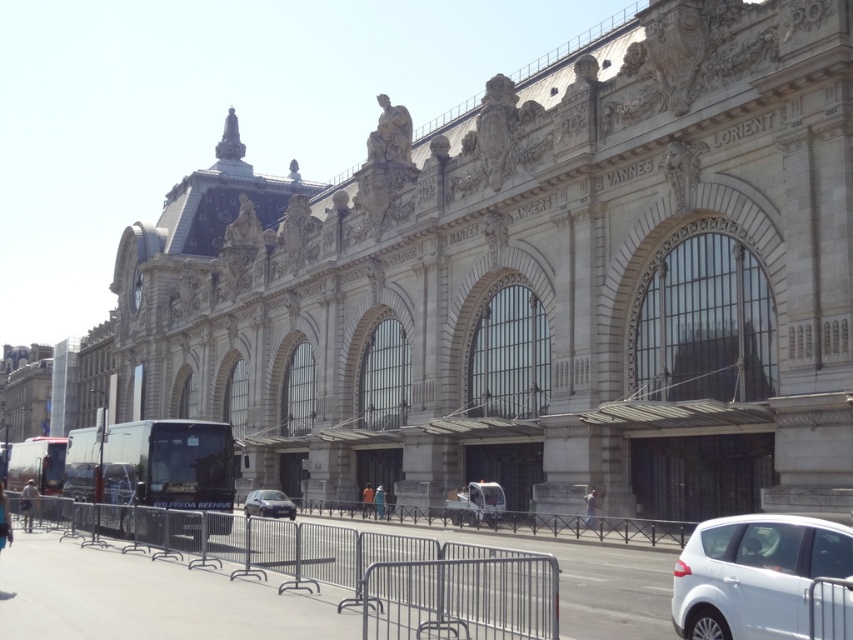
Question: Is the position of light brown leather jacket at lower left more distant than that of blue fabric person at center?

Choices:
 (A) yes
 (B) no

Answer: (B)

Question: Which point is closer to the camera?

Choices:
 (A) (270, 515)
 (B) (22, 508)
 (C) (51, 436)
 (D) (677, 620)

Answer: (D)

Question: Is shiny silver sedan at center to the right of light brown leather jacket at lower left from the viewer's perspective?

Choices:
 (A) yes
 (B) no

Answer: (A)

Question: Which point appears closest to the camera in this image?

Choices:
 (A) (381, 508)
 (B) (291, 508)
 (C) (718, 596)
 (D) (0, 508)

Answer: (C)

Question: Which of these objects is positioned closest to the light brown leather jacket at center?

Choices:
 (A) white matte suv at lower right
 (B) orange fabric jacket at center

Answer: (B)

Question: Does shiny silver sedan at center lie in front of blue fabric person at center?

Choices:
 (A) no
 (B) yes

Answer: (B)